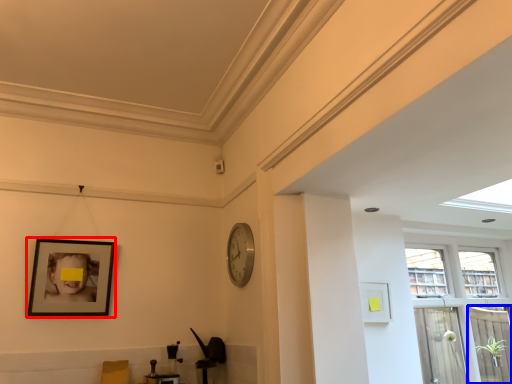
Question: Which of the following is the farthest to the observer, picture frame (highlighted by a red box) or screen door (highlighted by a blue box)?

Choices:
 (A) picture frame
 (B) screen door

Answer: (B)